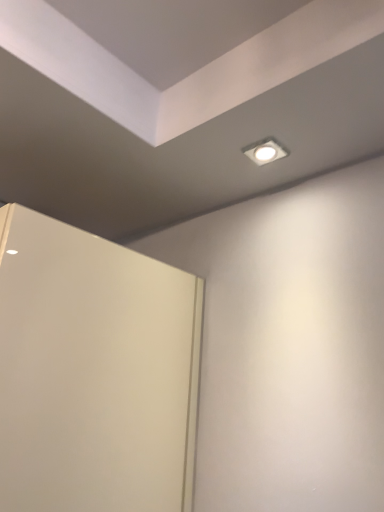
Question: Can you confirm if white glossy square light at upper center is positioned to the right of white matte door at left?

Choices:
 (A) yes
 (B) no

Answer: (A)

Question: Does white glossy square light at upper center have a greater height compared to white matte door at left?

Choices:
 (A) no
 (B) yes

Answer: (A)

Question: Is white glossy square light at upper center turned away from white matte door at left?

Choices:
 (A) no
 (B) yes

Answer: (A)

Question: Can you confirm if white glossy square light at upper center is shorter than white matte door at left?

Choices:
 (A) yes
 (B) no

Answer: (A)

Question: Could you tell me if white glossy square light at upper center is facing white matte door at left?

Choices:
 (A) yes
 (B) no

Answer: (B)

Question: Is white glossy square light at upper center further to the viewer compared to white matte door at left?

Choices:
 (A) yes
 (B) no

Answer: (A)

Question: Does white matte door at left have a larger size compared to white glossy square light at upper center?

Choices:
 (A) no
 (B) yes

Answer: (B)

Question: Considering the relative sizes of white matte door at left and white glossy square light at upper center in the image provided, is white matte door at left shorter than white glossy square light at upper center?

Choices:
 (A) no
 (B) yes

Answer: (A)

Question: Is white matte door at left smaller than white glossy square light at upper center?

Choices:
 (A) no
 (B) yes

Answer: (A)

Question: Is white matte door at left turned away from white glossy square light at upper center?

Choices:
 (A) yes
 (B) no

Answer: (B)

Question: Is white matte door at left facing towards white glossy square light at upper center?

Choices:
 (A) no
 (B) yes

Answer: (A)

Question: Does white matte door at left have a greater width compared to white glossy square light at upper center?

Choices:
 (A) no
 (B) yes

Answer: (A)

Question: From their relative heights in the image, would you say white glossy square light at upper center is taller or shorter than white matte door at left?

Choices:
 (A) short
 (B) tall

Answer: (A)